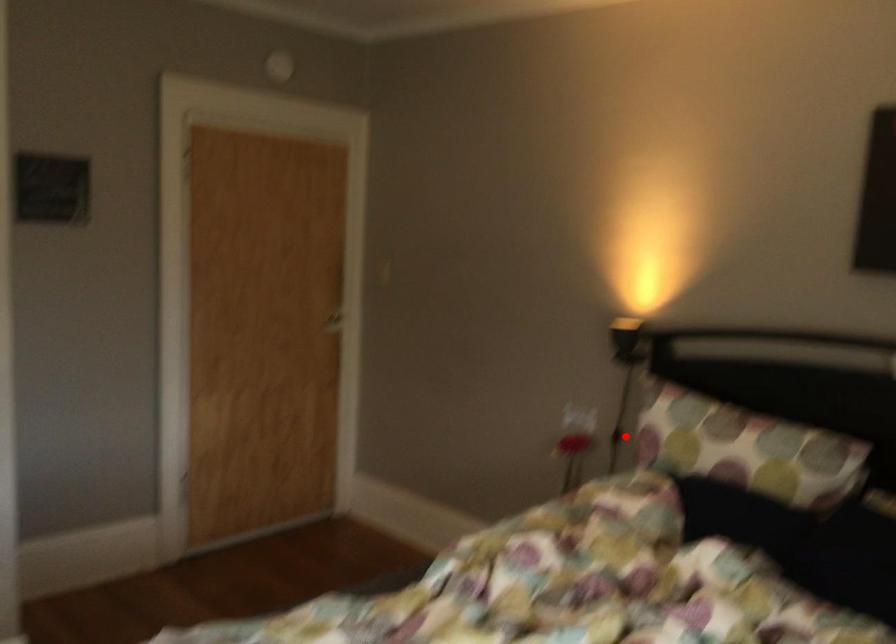
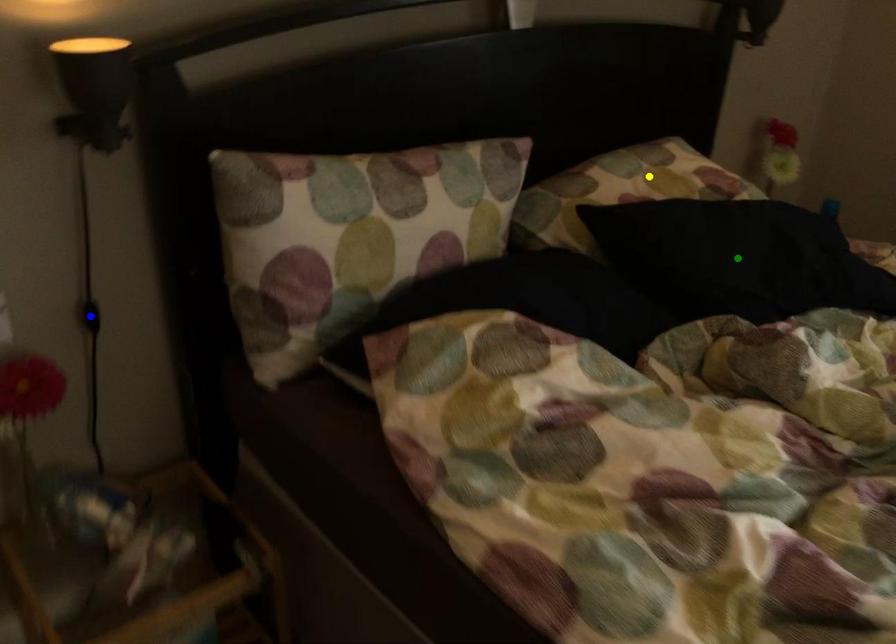
Question: I am providing you with two images of the same scene from different viewpoints. A red point is marked on the first image. You are given multiple points on the second image. In image 2, which mark is for the same physical point as the one in image 1?

Choices:
 (A) green point
 (B) yellow point
 (C) blue point

Answer: (C)